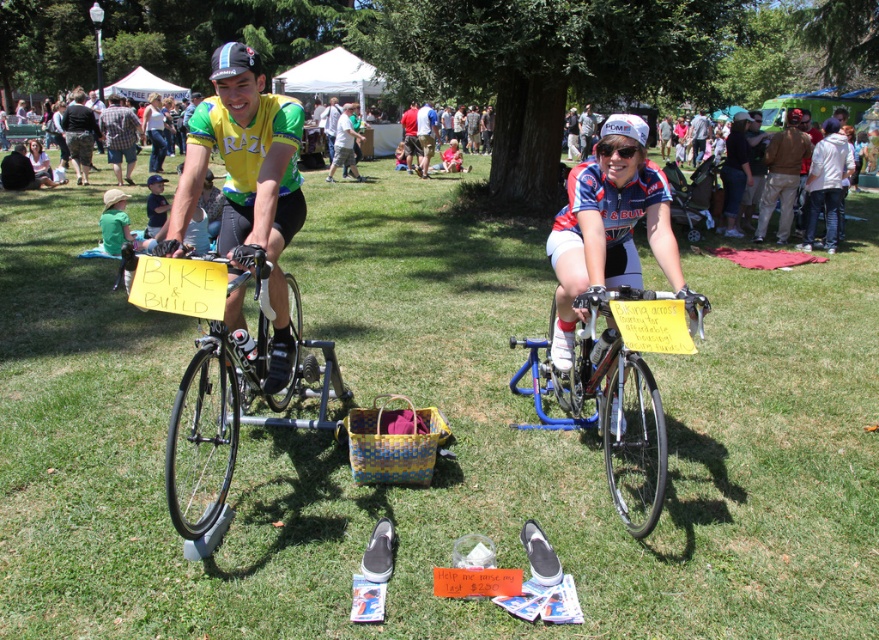
Does white jersey at center appear on the right side of light blue jersey at center?

Yes, white jersey at center is to the right of light blue jersey at center.

In the scene shown: Who is more distant from viewer, (551, 253) or (342, 122)?

The point (342, 122) is behind.

Which is in front, point (608, 163) or point (346, 122)?

Point (608, 163) is in front.

The width and height of the screenshot is (879, 640). I want to click on white jersey at center, so click(x=607, y=234).

Between shiny black frame at left and light blue jersey at center, which one appears on the right side from the viewer's perspective?

Positioned to the right is shiny black frame at left.

Image resolution: width=879 pixels, height=640 pixels. Find the location of `shiny black frame at left`. shiny black frame at left is located at coordinates (233, 412).

Is point (226, 392) positioned behind point (336, 145)?

No, (226, 392) is closer to viewer.

Locate an element on the screen. shiny black frame at left is located at coordinates (233, 412).

Can you confirm if shiny black frame at left is positioned to the left of blue metallic bicycle at center?

Yes, shiny black frame at left is to the left of blue metallic bicycle at center.

Can you confirm if shiny black frame at left is wider than blue metallic bicycle at center?

Incorrect, shiny black frame at left's width does not surpass blue metallic bicycle at center's.

Find the location of `shiny black frame at left`. shiny black frame at left is located at coordinates (233, 412).

This screenshot has width=879, height=640. What are the coordinates of `shiny black frame at left` in the screenshot? It's located at (233, 412).